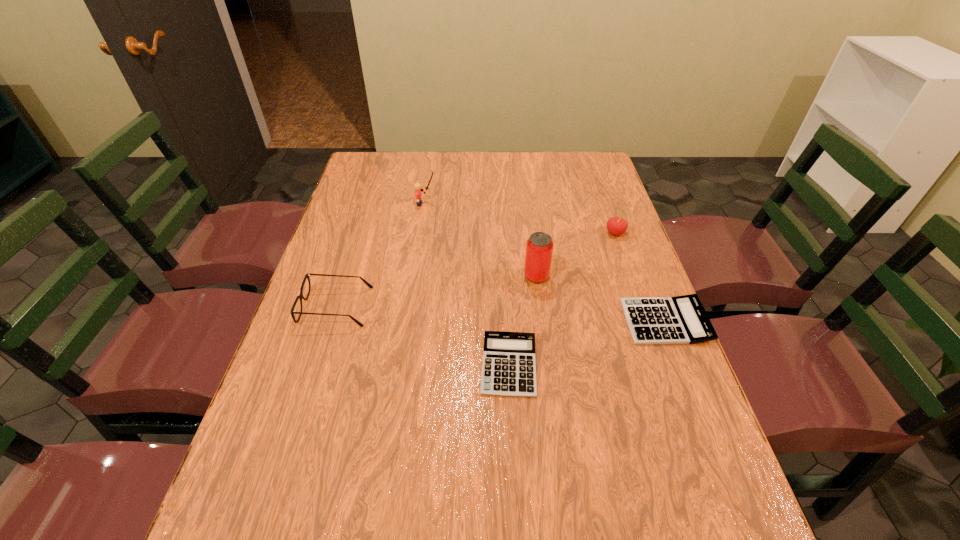
Observe the arrangement of all calculators in the image. To keep them evenly spaced, where would you place another calculator on the left? Please locate a free space. Please provide its 2D coordinates. Your answer should be formatted as a tuple, i.e. [(x, y)], where the tuple contains the x and y coordinates of a point satisfying the conditions above.

[(321, 417)]